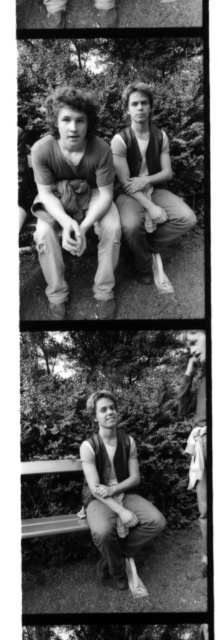
Does matte black tank top at center have a greater width compared to matte brown vest at right?

Yes, matte black tank top at center is wider than matte brown vest at right.

Does matte black tank top at center have a larger size compared to matte brown vest at right?

Correct, matte black tank top at center is larger in size than matte brown vest at right.

Is point (119, 464) positioned before point (187, 403)?

Yes.

Image resolution: width=218 pixels, height=640 pixels. I want to click on matte black tank top at center, so click(115, 492).

Does matte brown hair at center lie in front of matte brown vest at center?

Yes, matte brown hair at center is closer to the viewer.

Who is shorter, matte brown hair at center or matte brown vest at center?

matte brown vest at center is shorter.

Is point (73, 148) positioned before point (129, 230)?

That is True.

You are a GUI agent. You are given a task and a screenshot of the screen. Output one action in this format:
    pyautogui.click(x=<x>, y=<y>)
    Task: Click on the matte brown hair at center
    This screenshot has height=640, width=218.
    Given the screenshot: What is the action you would take?
    pyautogui.click(x=74, y=198)

Does matte brown hair at center have a smaller size compared to matte brown vest at right?

No.

Does matte brown hair at center lie in front of matte brown vest at right?

Yes.

Is point (80, 147) less distant than point (194, 417)?

Yes, point (80, 147) is closer to viewer.

The image size is (218, 640). I want to click on matte brown hair at center, so click(x=74, y=198).